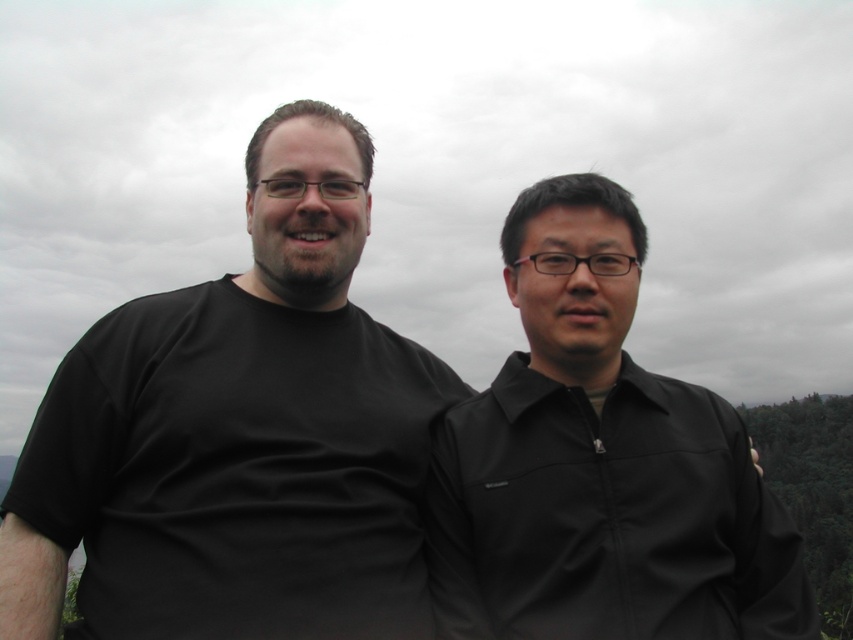
Consider the image. You are a photographer trying to capture a photo of the black matte t shirt at left. The camera you are using has a focus point at coordinate point (236, 470). Will the focus point align with the black matte t shirt at left?

The black matte t shirt at left is represented by point (236, 470), so yes, the focus point will align with the black matte t shirt at left.